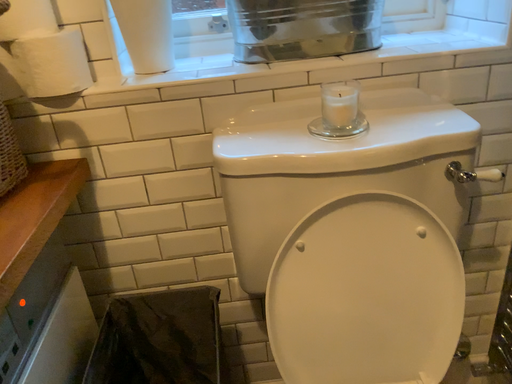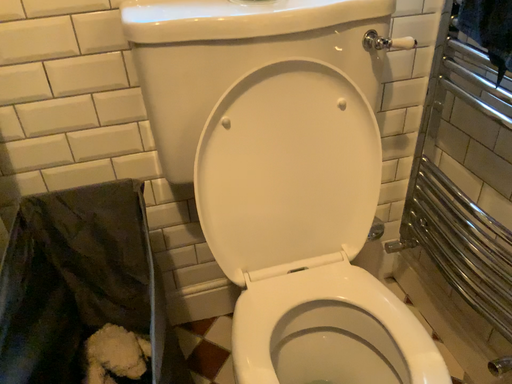
Question: How did the camera likely rotate when shooting the video?

Choices:
 (A) rotated right
 (B) rotated left

Answer: (A)